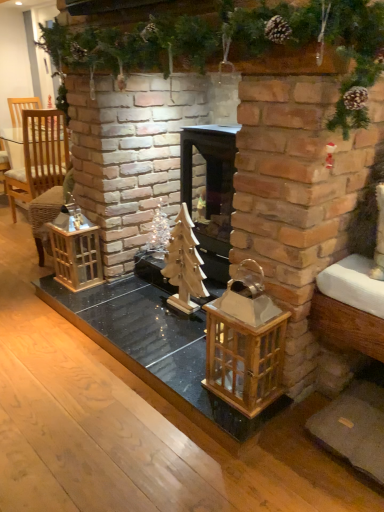
Measure the distance between point (178, 243) and camera.

The distance of point (178, 243) from camera is 2.20 meters.

What do you see at coordinates (184, 265) in the screenshot? This screenshot has width=384, height=512. I see `wooden christmas tree at center` at bounding box center [184, 265].

Where is `wooden christmas tree at center`? The image size is (384, 512). wooden christmas tree at center is located at coordinates (229, 42).

Based on the photo, in order to face wooden lantern at center, the 2th cage in the back-to-front sequence, should I rotate leftwards or rightwards?

Rotate right and turn 7.223 degrees.

Consider the image. What is the approximate width of wooden lantern at left, the 1th cage viewed from the back?

wooden lantern at left, the 1th cage viewed from the back, is 21.26 centimeters wide.

At what (x,y) coordinates should I click in order to perform the action: click on wooden christmas tree at center. Please return your answer as a coordinate pair (x, y). The width and height of the screenshot is (384, 512). Looking at the image, I should click on (184, 265).

Which of these two, wooden christmas tree at center or wooden christmas tree at center, stands shorter?

wooden christmas tree at center.

Is wooden christmas tree at center oriented towards wooden christmas tree at center?

No, wooden christmas tree at center is not facing towards wooden christmas tree at center.

From the picture: Does wooden christmas tree at center lie behind wooden christmas tree at center?

Yes.

Does point (184, 275) lie behind point (378, 36)?

Yes, it is behind point (378, 36).

Which object is closer to the camera, woven wicker armchair at left or wooden christmas tree at center?

wooden christmas tree at center is closer to the camera.

How much distance is there between woven wicker armchair at left and wooden christmas tree at center?

1.38 meters.

Is point (59, 139) closer to viewer compared to point (198, 65)?

No, (59, 139) is behind (198, 65).

Considering the sizes of woven wicker armchair at left and wooden christmas tree at center in the image, is woven wicker armchair at left bigger or smaller than wooden christmas tree at center?

woven wicker armchair at left is smaller than wooden christmas tree at center.

The height and width of the screenshot is (512, 384). I want to click on christmas tree in front of the wooden lantern at left, which appears as the 2th cage when viewed from the front, so click(x=184, y=265).

How distant is wooden christmas tree at center from wooden lantern at left, which appears as the 2th cage when viewed from the front?

A distance of 21.47 inches exists between wooden christmas tree at center and wooden lantern at left, which appears as the 2th cage when viewed from the front.

Is wooden christmas tree at center taller than wooden lantern at left, arranged as the 1th cage when viewed from the left?

Indeed, wooden christmas tree at center has a greater height compared to wooden lantern at left, arranged as the 1th cage when viewed from the left.

Considering the sizes of objects wooden christmas tree at center and wooden lantern at left, marked as the 2th cage in a right-to-left arrangement, in the image provided, who is bigger, wooden christmas tree at center or wooden lantern at left, marked as the 2th cage in a right-to-left arrangement,?

wooden lantern at left, marked as the 2th cage in a right-to-left arrangement, is bigger.

Is wooden lantern at center, the 2th cage in the back-to-front sequence, next to wooden lantern at left, marked as the 2th cage in a right-to-left arrangement, and touching it?

No, wooden lantern at center, the 2th cage in the back-to-front sequence, is not in contact with wooden lantern at left, marked as the 2th cage in a right-to-left arrangement.

Consider the image. What's the angular difference between wooden lantern at center, which ranks as the 1th cage in right-to-left order, and wooden lantern at left, marked as the 2th cage in a right-to-left arrangement,'s facing directions?

wooden lantern at center, which ranks as the 1th cage in right-to-left order, and wooden lantern at left, marked as the 2th cage in a right-to-left arrangement, are facing 0.000837 degrees away from each other.

Where is `cage on the right of the wooden lantern at left, marked as the 2th cage in a right-to-left arrangement`? The width and height of the screenshot is (384, 512). cage on the right of the wooden lantern at left, marked as the 2th cage in a right-to-left arrangement is located at coordinates (245, 343).

Which point is more forward, [242,283] or [78,225]?

The point [242,283] is closer to the camera.

Is wooden lantern at center, the 2th cage in the back-to-front sequence, aimed at wooden christmas tree at center?

No, wooden lantern at center, the 2th cage in the back-to-front sequence, is not turned towards wooden christmas tree at center.

Which is farther from the camera, (x=234, y=318) or (x=381, y=37)?

The point (x=234, y=318) is farther.

Between wooden lantern at center, which ranks as the first cage in front-to-back order, and wooden christmas tree at center, which one appears on the right side from the viewer's perspective?

Positioned to the right is wooden lantern at center, which ranks as the first cage in front-to-back order.

Measure the distance between wooden lantern at center, the 2th cage in the back-to-front sequence, and wooden christmas tree at center.

wooden lantern at center, the 2th cage in the back-to-front sequence, is 33.35 inches away from wooden christmas tree at center.

From the picture: From a real-world perspective, does wooden christmas tree at center sit lower than black wood fireplace at center?

No, from a real-world perspective, wooden christmas tree at center is not under black wood fireplace at center.

Does wooden christmas tree at center lie behind black wood fireplace at center?

No, it is in front of black wood fireplace at center.

Is wooden christmas tree at center aimed at black wood fireplace at center?

No, wooden christmas tree at center is not oriented towards black wood fireplace at center.

Considering the positions of objects wooden lantern at center, which ranks as the first cage in front-to-back order, and black wood fireplace at center in the image provided, who is more to the right, wooden lantern at center, which ranks as the first cage in front-to-back order, or black wood fireplace at center?

black wood fireplace at center.

From the image's perspective, does wooden lantern at center, the second cage viewed from the left, appear higher than black wood fireplace at center?

No.

Between wooden lantern at center, the second cage viewed from the left, and black wood fireplace at center, which one has smaller size?

wooden lantern at center, the second cage viewed from the left.

Is wooden lantern at center, the second cage viewed from the left, looking in the opposite direction of black wood fireplace at center?

No, wooden lantern at center, the second cage viewed from the left,'s orientation is not away from black wood fireplace at center.

Where is `christmas tree lying below the wooden christmas tree at center (from the image's perspective)`? The image size is (384, 512). christmas tree lying below the wooden christmas tree at center (from the image's perspective) is located at coordinates (184, 265).

Locate an element on the screen. christmas decoration on the right of woven wicker armchair at left is located at coordinates (229, 42).

When comparing their distances from black wood fireplace at center, does woven wicker armchair at left or wooden lantern at left, which appears as the 2th cage when viewed from the front, seem closer?

wooden lantern at left, which appears as the 2th cage when viewed from the front, lies closer to black wood fireplace at center than the other object.

When comparing their distances from wooden lantern at left, which appears as the 2th cage when viewed from the front, does wooden lantern at center, which ranks as the first cage in front-to-back order, or woven wicker armchair at left seem closer?

wooden lantern at center, which ranks as the first cage in front-to-back order, lies closer to wooden lantern at left, which appears as the 2th cage when viewed from the front, than the other object.

Estimate the real-world distances between objects in this image. Which object is closer to wooden christmas tree at center, woven wicker armchair at left or wooden lantern at center, which ranks as the first cage in front-to-back order?

wooden lantern at center, which ranks as the first cage in front-to-back order, is positioned closer to the anchor wooden christmas tree at center.

From the image, which object appears to be nearer to wooden lantern at left, arranged as the 1th cage when viewed from the left, wooden christmas tree at center or wooden christmas tree at center?

Based on the image, wooden christmas tree at center appears to be nearer to wooden lantern at left, arranged as the 1th cage when viewed from the left.

Which object lies nearer to the anchor point wooden lantern at left, the 1th cage viewed from the back, wooden lantern at center, the second cage viewed from the left, or black wood fireplace at center?

black wood fireplace at center is positioned closer to the anchor wooden lantern at left, the 1th cage viewed from the back.

Considering their positions, is woven wicker armchair at left positioned closer to wooden christmas tree at center than wooden christmas tree at center?

wooden christmas tree at center lies closer to wooden christmas tree at center than the other object.

From the image, which object appears to be farther from wooden christmas tree at center, woven wicker armchair at left or wooden lantern at center, the second cage viewed from the left?

woven wicker armchair at left is positioned further to the anchor wooden christmas tree at center.

From the image, which object appears to be nearer to wooden lantern at center, which ranks as the first cage in front-to-back order, wooden lantern at left, marked as the 2th cage in a right-to-left arrangement, or wooden christmas tree at center?

Based on the image, wooden christmas tree at center appears to be nearer to wooden lantern at center, which ranks as the first cage in front-to-back order.

Where is `fireplace between wooden christmas tree at center and wooden christmas tree at center along the z-axis`? The width and height of the screenshot is (384, 512). fireplace between wooden christmas tree at center and wooden christmas tree at center along the z-axis is located at coordinates (211, 193).

In order to click on fireplace between wooden lantern at center, which ranks as the 1th cage in right-to-left order, and wooden christmas tree at center, along the z-axis in this screenshot , I will do `click(211, 193)`.

You are a GUI agent. You are given a task and a screenshot of the screen. Output one action in this format:
    pyautogui.click(x=<x>, y=<y>)
    Task: Click on the christmas tree between wooden christmas tree at center and woven wicker armchair at left in the front-back direction
    
    Given the screenshot: What is the action you would take?
    pyautogui.click(x=184, y=265)

What are the coordinates of `cage located between wooden lantern at left, which appears as the 2th cage when viewed from the front, and black wood fireplace at center in the left-right direction` in the screenshot? It's located at (245, 343).